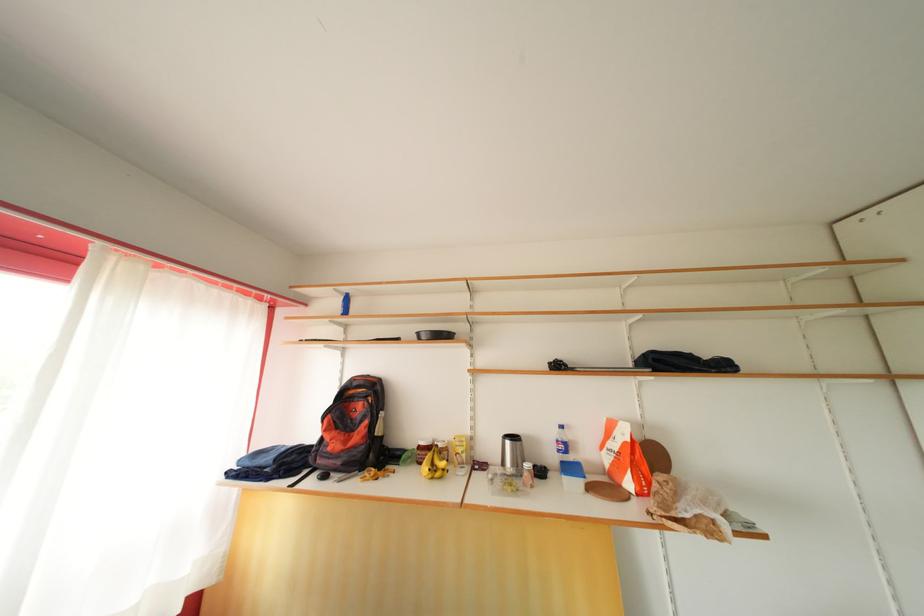
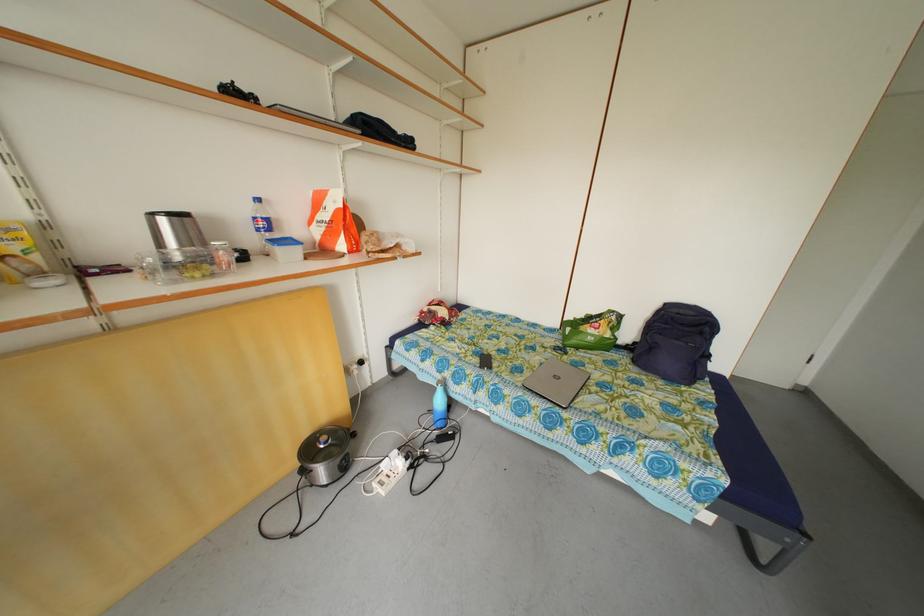
In the second image, find the point that corresponds to point 622,451 in the first image.

(332, 222)